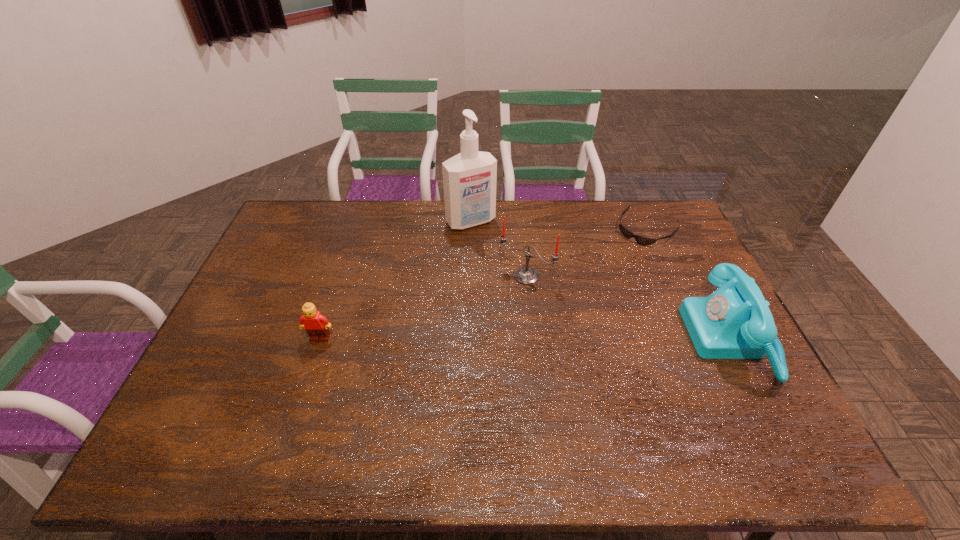
Locate an element on the screen. free spot on the desktop that is between the leftmost object and the telephone and is positioned on the front-facing side of the third nearest object is located at coordinates (485, 339).

You are a GUI agent. You are given a task and a screenshot of the screen. Output one action in this format:
    pyautogui.click(x=<x>, y=<y>)
    Task: Click on the vacant space on the desktop that is between the leftmost object and the telephone and is positioned on the front label of the tallest object
    The image size is (960, 540).
    Given the screenshot: What is the action you would take?
    pyautogui.click(x=556, y=339)

What are the coordinates of `vacant space on the desktop that is between the Lego and the telephone and is positioned on the front-facing side of the sunglasses` in the screenshot? It's located at (534, 339).